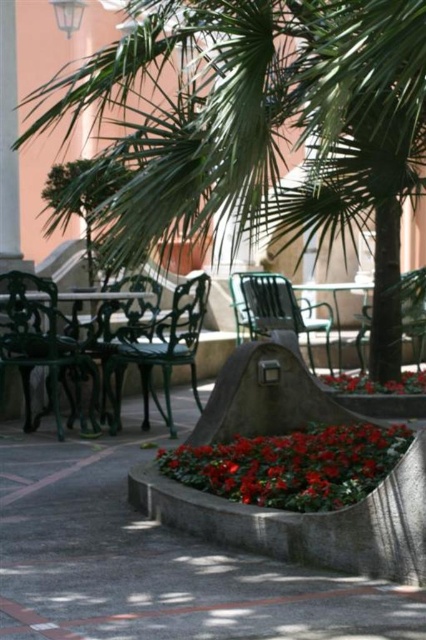
Question: Is green leafy palm tree at center closer to the viewer compared to glossy red flowers at center?

Choices:
 (A) no
 (B) yes

Answer: (B)

Question: Which object appears farthest from the camera in this image?

Choices:
 (A) concrete at center
 (B) metallic green park bench at center

Answer: (B)

Question: Does glossy red flowers at center have a lesser width compared to metallic green park bench at center?

Choices:
 (A) no
 (B) yes

Answer: (A)

Question: Is glossy red flowers at center to the right of glossy red flower at lower center from the viewer's perspective?

Choices:
 (A) yes
 (B) no

Answer: (B)

Question: Which of the following is the closest to the observer?

Choices:
 (A) click(x=397, y=390)
 (B) click(x=124, y=548)
 (C) click(x=313, y=499)
 (D) click(x=273, y=300)

Answer: (C)

Question: Estimate the real-world distances between objects in this image. Which object is closer to the concrete at center?

Choices:
 (A) glossy red flower at lower center
 (B) metallic green park bench at center

Answer: (B)